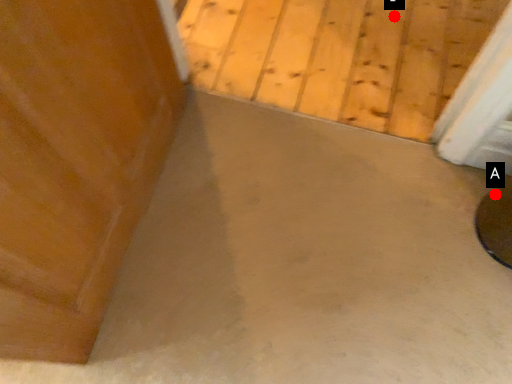
Question: Two points are circled on the image, labeled by A and B beside each circle. Which point is closer to the camera?

Choices:
 (A) A is closer
 (B) B is closer

Answer: (A)